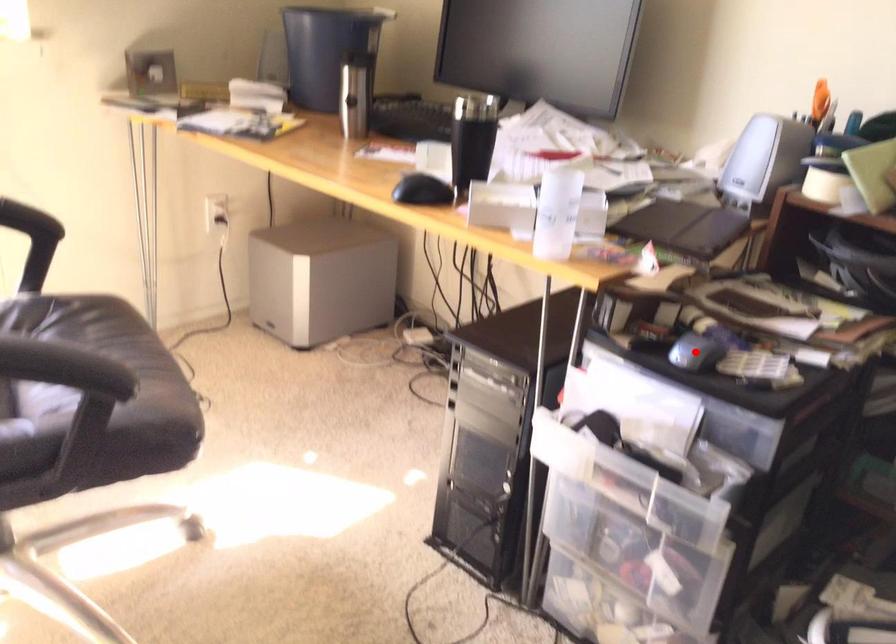
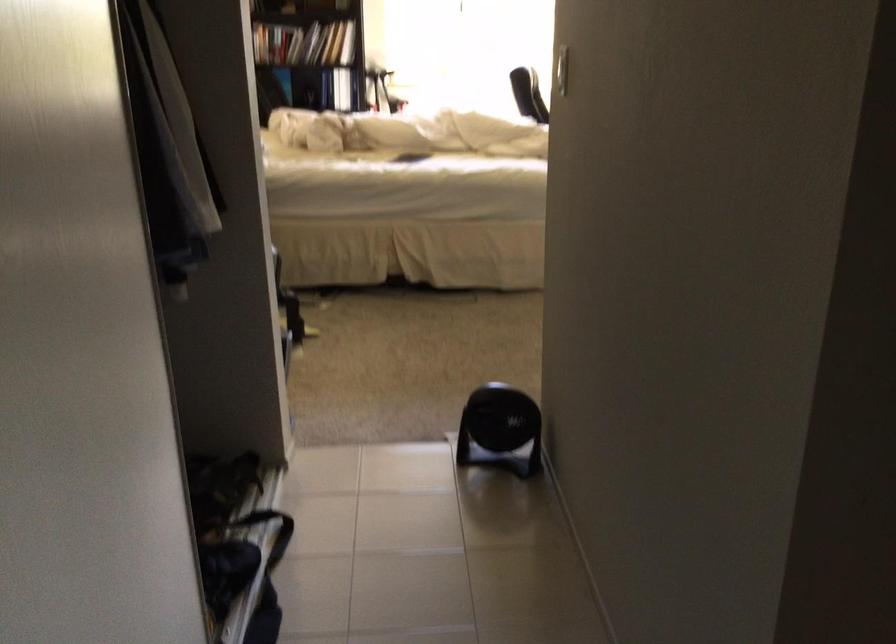
Question: I am providing you with two images of the same scene from different viewpoints. A red point is marked on the first image. At the location where the point appears in image 1, is it still visible in image 2?

Choices:
 (A) Yes
 (B) No

Answer: (B)